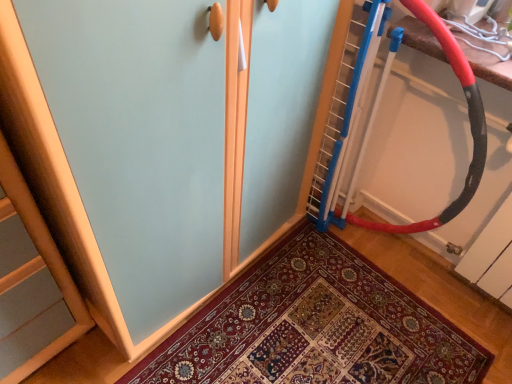
Question: Is red rubber garden hose at right positioned with its back to patterned carpet at center?

Choices:
 (A) no
 (B) yes

Answer: (A)

Question: From a real-world perspective, is red rubber garden hose at right positioned under patterned carpet at center based on gravity?

Choices:
 (A) yes
 (B) no

Answer: (B)

Question: Is there a large distance between red rubber garden hose at right and patterned carpet at center?

Choices:
 (A) yes
 (B) no

Answer: (B)

Question: Does red rubber garden hose at right have a lesser height compared to patterned carpet at center?

Choices:
 (A) no
 (B) yes

Answer: (A)

Question: Is red rubber garden hose at right touching patterned carpet at center?

Choices:
 (A) yes
 (B) no

Answer: (B)

Question: Considering the relative positions of red rubber garden hose at right and patterned carpet at center in the image provided, is red rubber garden hose at right to the right of patterned carpet at center from the viewer's perspective?

Choices:
 (A) yes
 (B) no

Answer: (A)

Question: Is the surface of patterned carpet at center in direct contact with red rubber garden hose at right?

Choices:
 (A) yes
 (B) no

Answer: (B)

Question: Could you tell me if patterned carpet at center is facing red rubber garden hose at right?

Choices:
 (A) no
 (B) yes

Answer: (A)

Question: Is patterned carpet at center wider than red rubber garden hose at right?

Choices:
 (A) yes
 (B) no

Answer: (A)

Question: Does patterned carpet at center appear on the left side of red rubber garden hose at right?

Choices:
 (A) yes
 (B) no

Answer: (A)

Question: From a real-world perspective, is patterned carpet at center on red rubber garden hose at right?

Choices:
 (A) yes
 (B) no

Answer: (B)

Question: From a real-world perspective, is patterned carpet at center positioned under red rubber garden hose at right based on gravity?

Choices:
 (A) yes
 (B) no

Answer: (A)

Question: Is red rubber garden hose at right wider or thinner than patterned carpet at center?

Choices:
 (A) wide
 (B) thin

Answer: (B)